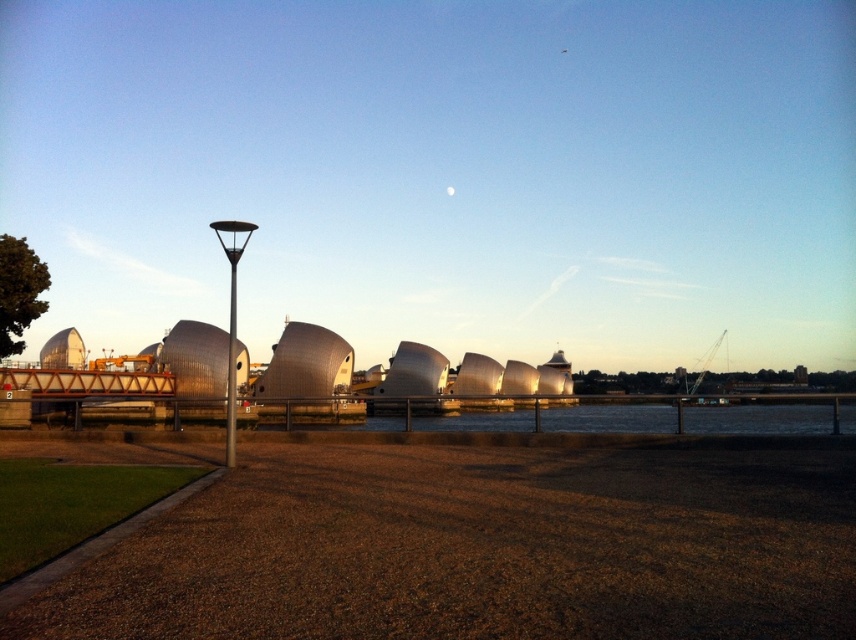
Between silver metallic lamp post at left and metallic pole at left, which one has less height?

With less height is metallic pole at left.

Who is more distant from viewer, (229,435) or (230,372)?

Positioned behind is point (230,372).

Find the location of a particular element. silver metallic lamp post at left is located at coordinates (232, 320).

Who is shorter, green grass at lower left or metallic pole at left?

green grass at lower left is shorter.

Measure the distance from green grass at lower left to metallic pole at left.

green grass at lower left is 74.14 meters from metallic pole at left.

What are the coordinates of `green grass at lower left` in the screenshot? It's located at (94, 545).

This screenshot has width=856, height=640. Find the location of `green grass at lower left`. green grass at lower left is located at coordinates (94, 545).

Which is more to the left, green grass at lower left or silver metallic lamp post at left?

From the viewer's perspective, silver metallic lamp post at left appears more on the left side.

Does green grass at lower left have a greater width compared to silver metallic lamp post at left?

No.

Does point (212, 483) lie behind point (230, 372)?

No, it is in front of (230, 372).

Where is `green grass at lower left`? This screenshot has height=640, width=856. green grass at lower left is located at coordinates (94, 545).